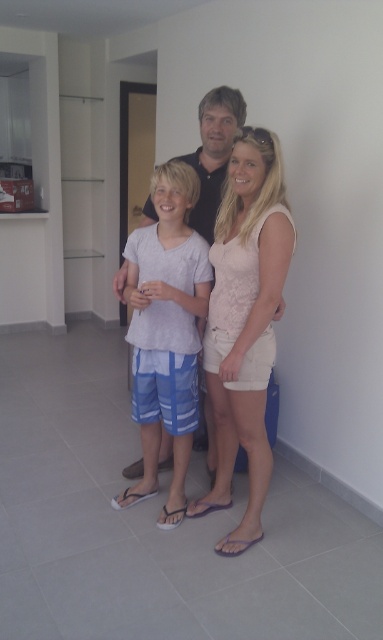
Question: Can you confirm if pale pink lace top at center is smaller than white cotton shirt at center?

Choices:
 (A) yes
 (B) no

Answer: (A)

Question: Which point is closer to the camera?

Choices:
 (A) (194, 390)
 (B) (230, 248)

Answer: (B)

Question: Which object is closer to the camera taking this photo?

Choices:
 (A) pale pink lace top at center
 (B) white cotton shirt at center

Answer: (A)

Question: Is pale pink lace top at center above white cotton shirt at center?

Choices:
 (A) yes
 (B) no

Answer: (A)

Question: Is pale pink lace top at center below white cotton shirt at center?

Choices:
 (A) no
 (B) yes

Answer: (A)